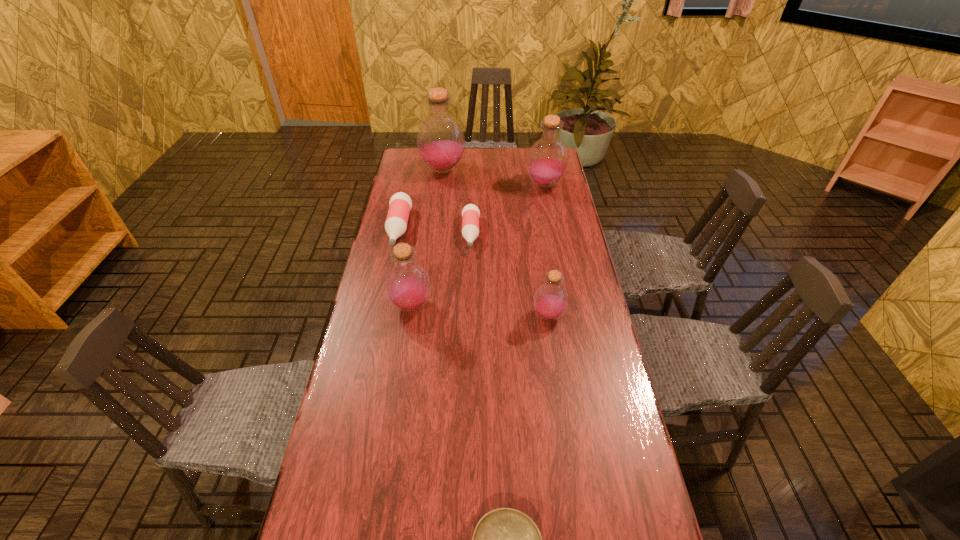
Locate an element on the screen. The height and width of the screenshot is (540, 960). free region at the far edge is located at coordinates (505, 155).

This screenshot has height=540, width=960. I want to click on free space at the left edge of the desktop, so click(429, 194).

The height and width of the screenshot is (540, 960). In order to click on free space at the right edge of the desktop in this screenshot , I will do `click(576, 301)`.

At what (x,y) coordinates should I click in order to perform the action: click on blank space at the far left corner of the desktop. Please return your answer as a coordinate pair (x, y). The width and height of the screenshot is (960, 540). Looking at the image, I should click on (404, 157).

Find the location of a particular element. empty location between the fifth shortest bottle and the third tallest bottle is located at coordinates (478, 245).

Where is `object identified as the fourth closest to the shortest object`? Image resolution: width=960 pixels, height=540 pixels. object identified as the fourth closest to the shortest object is located at coordinates (400, 204).

Identify which object is the second closest to the bigger pink bottle. Please provide its 2D coordinates. Your answer should be formatted as a tuple, i.e. [(x, y)], where the tuple contains the x and y coordinates of a point satisfying the conditions above.

[(407, 285)]

The image size is (960, 540). I want to click on bottle that is the fourth closest to the right pink bottle, so click(x=547, y=161).

Identify which bottle is located as the second nearest to the bowl. Please provide its 2D coordinates. Your answer should be formatted as a tuple, i.e. [(x, y)], where the tuple contains the x and y coordinates of a point satisfying the conditions above.

[(407, 285)]

Identify which purple bottle is located as the second nearest to the third shortest object. Please provide its 2D coordinates. Your answer should be formatted as a tuple, i.e. [(x, y)], where the tuple contains the x and y coordinates of a point satisfying the conditions above.

[(407, 285)]